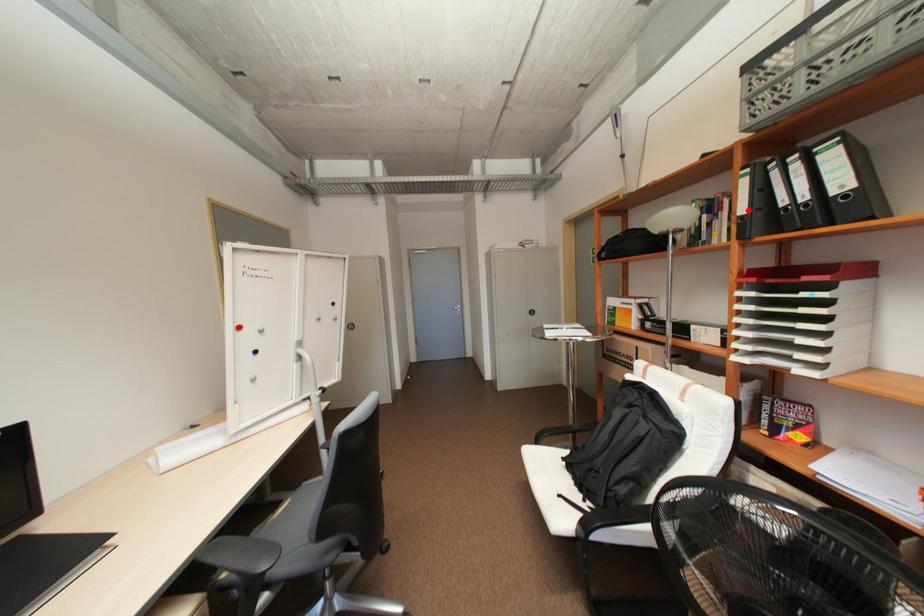
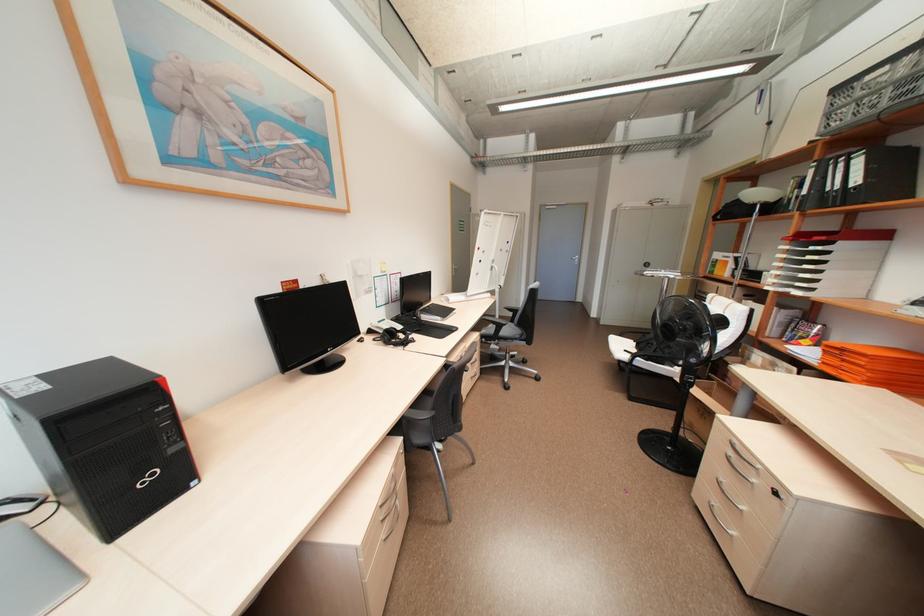
The point at the highlighted location is marked in the first image. Where is the corresponding point in the second image?

(810, 191)